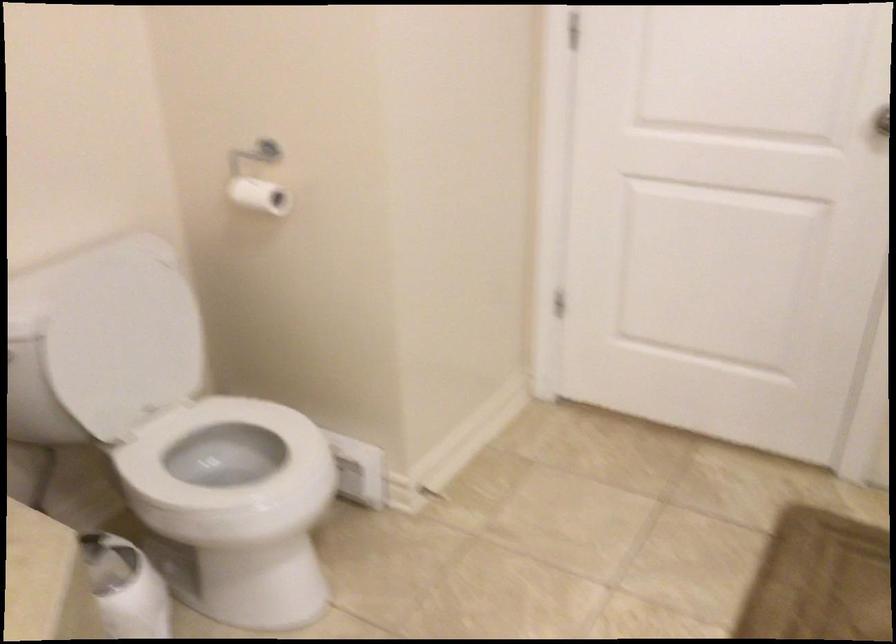
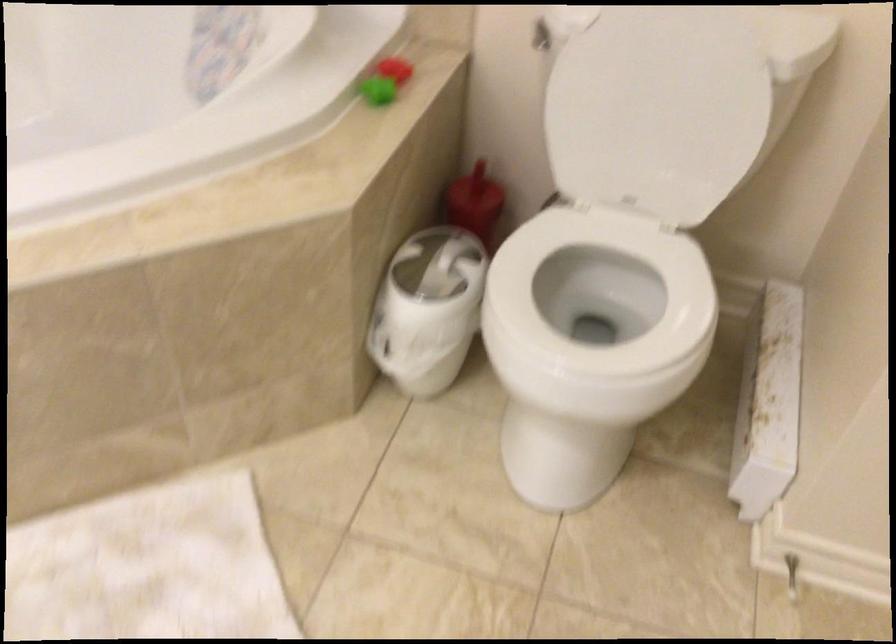
In the second image, find the point that corresponds to pixel 122 333 in the first image.

(657, 109)